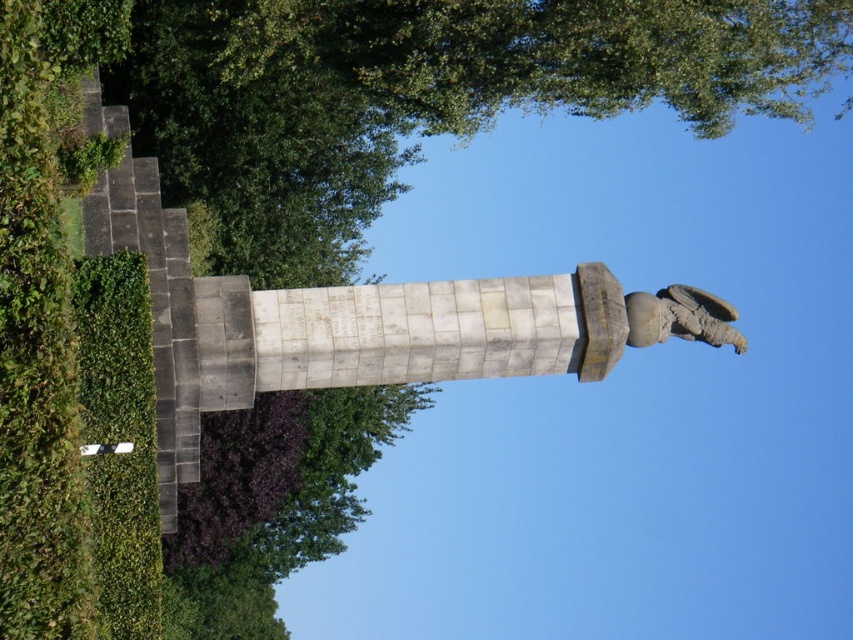
Does green leafy tree at upper center have a lesser width compared to stone statue at upper right?

No, green leafy tree at upper center is not thinner than stone statue at upper right.

Does green leafy tree at upper center have a greater height compared to stone statue at upper right?

Indeed, green leafy tree at upper center has a greater height compared to stone statue at upper right.

Is point (788, 13) less distant than point (643, 308)?

No, (788, 13) is behind (643, 308).

This screenshot has height=640, width=853. Find the location of `green leafy tree at upper center`. green leafy tree at upper center is located at coordinates (422, 93).